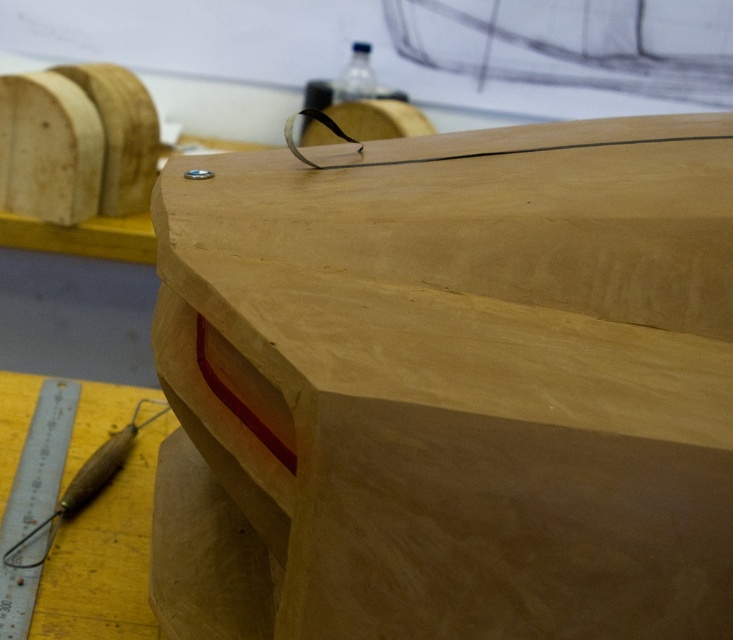
Question: Which point appears closest to the camera in this image?

Choices:
 (A) (12, 528)
 (B) (353, 67)

Answer: (A)

Question: Is the position of metallic silver ruler at lower left less distant than that of wooden carving tool at lower left?

Choices:
 (A) yes
 (B) no

Answer: (A)

Question: Among these objects, which one is nearest to the camera?

Choices:
 (A) natural wood plywood at center
 (B) metallic silver ruler at lower left
 (C) wooden carving tool at lower left

Answer: (A)

Question: Which object is positioned closest to the metallic silver ruler at lower left?

Choices:
 (A) natural wood plywood at center
 (B) wooden carving tool at lower left
 (C) transparent plastic bottle at upper center

Answer: (B)

Question: Observing the image, what is the correct spatial positioning of metallic silver ruler at lower left in reference to transparent plastic bottle at upper center?

Choices:
 (A) above
 (B) below

Answer: (B)

Question: Observing the image, what is the correct spatial positioning of natural wood plywood at center in reference to transparent plastic bottle at upper center?

Choices:
 (A) right
 (B) left

Answer: (A)